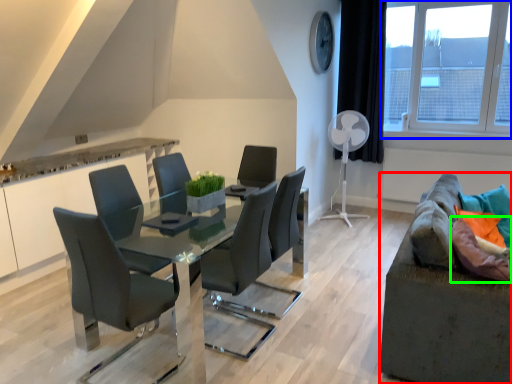
Question: Which object is positioned closest to studio couch (highlighted by a red box)? Select from window (highlighted by a blue box) and pillow (highlighted by a green box).

Choices:
 (A) window
 (B) pillow

Answer: (B)